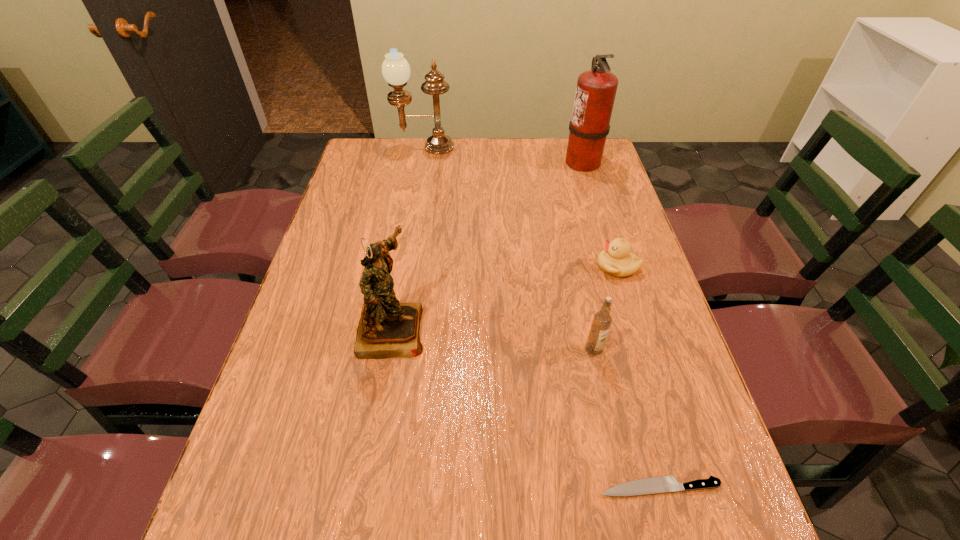
At what (x,y) coordinates should I click in order to perform the action: click on free location located 0.370m toward the nozzle of the fire extinguisher. Please return your answer as a coordinate pair (x, y). The image size is (960, 540). Looking at the image, I should click on (460, 161).

Locate an element on the screen. The height and width of the screenshot is (540, 960). vacant area located 0.180m on the front of the oil lamp is located at coordinates (418, 183).

Where is `vacant space located on the front-facing side of the fourth shortest object`? The image size is (960, 540). vacant space located on the front-facing side of the fourth shortest object is located at coordinates 446,328.

At what (x,y) coordinates should I click in order to perform the action: click on free spot located 0.160m on the label of the third shortest object. Please return your answer as a coordinate pair (x, y). The width and height of the screenshot is (960, 540). Looking at the image, I should click on (x=610, y=423).

You are a GUI agent. You are given a task and a screenshot of the screen. Output one action in this format:
    pyautogui.click(x=<x>, y=<y>)
    Task: Click on the free location located on the front-facing side of the duckling
    Image resolution: width=960 pixels, height=540 pixels.
    Given the screenshot: What is the action you would take?
    pyautogui.click(x=539, y=266)

You are a GUI agent. You are given a task and a screenshot of the screen. Output one action in this format:
    pyautogui.click(x=<x>, y=<y>)
    Task: Click on the blank space located on the front-facing side of the duckling
    The height and width of the screenshot is (540, 960).
    Given the screenshot: What is the action you would take?
    pyautogui.click(x=535, y=266)

The width and height of the screenshot is (960, 540). In order to click on vacant area situated 0.390m on the front-facing side of the duckling in this screenshot , I will do `click(453, 266)`.

Find the location of a particular element. The height and width of the screenshot is (540, 960). free spot located on the left of the steak knife is located at coordinates (378, 487).

Where is `fire extinguisher located in the far edge section of the desktop`? The width and height of the screenshot is (960, 540). fire extinguisher located in the far edge section of the desktop is located at coordinates (596, 89).

This screenshot has width=960, height=540. In order to click on oil lamp that is at the far edge in this screenshot , I will do `click(395, 69)`.